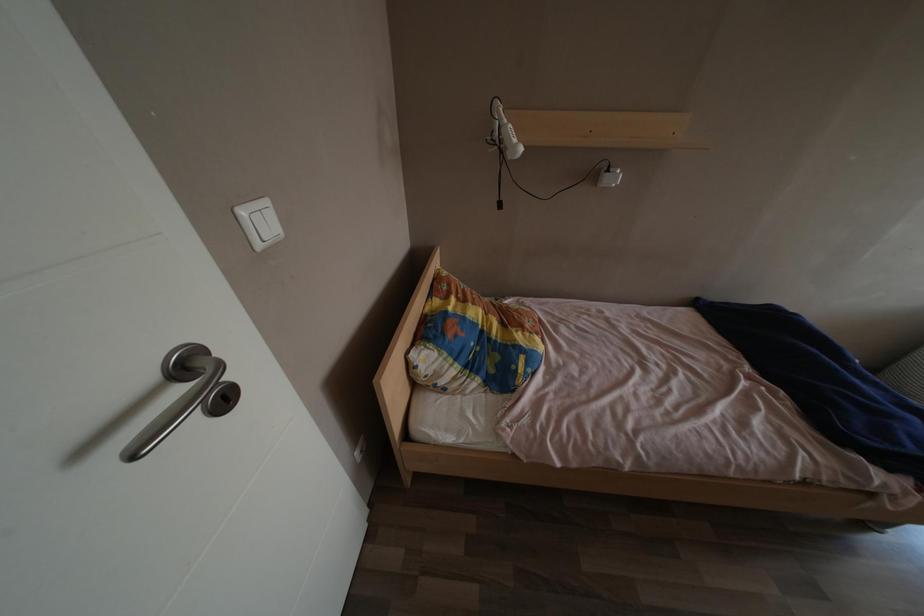
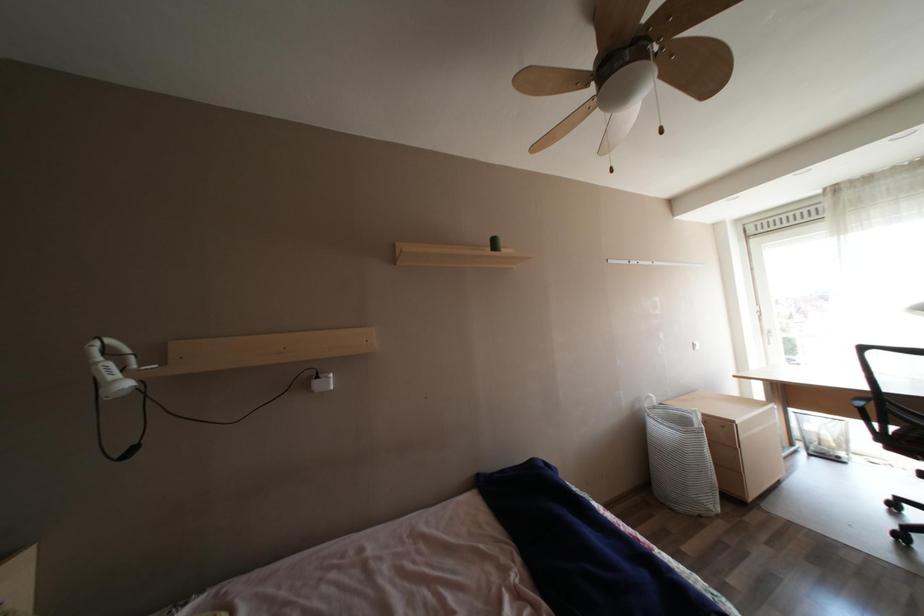
The first image is from the beginning of the video and the second image is from the end. How did the camera likely rotate when shooting the video?

The camera's rotation is toward right-up.